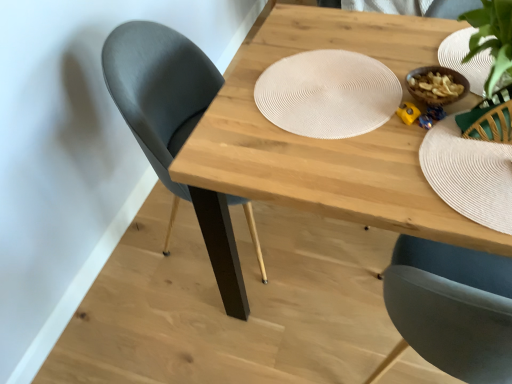
Where is `vacant space behind white woven placemat at center`? This screenshot has height=384, width=512. vacant space behind white woven placemat at center is located at coordinates (314, 42).